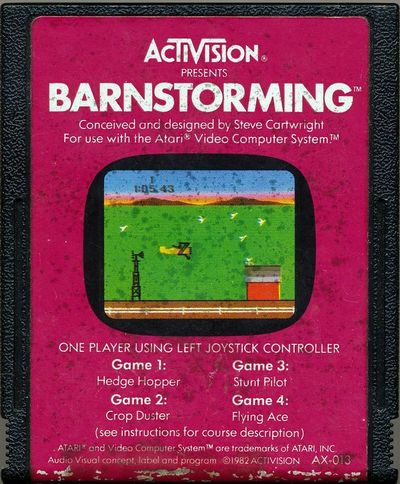
This screenshot has height=484, width=400. Identify the location of trashcan. (267, 288).